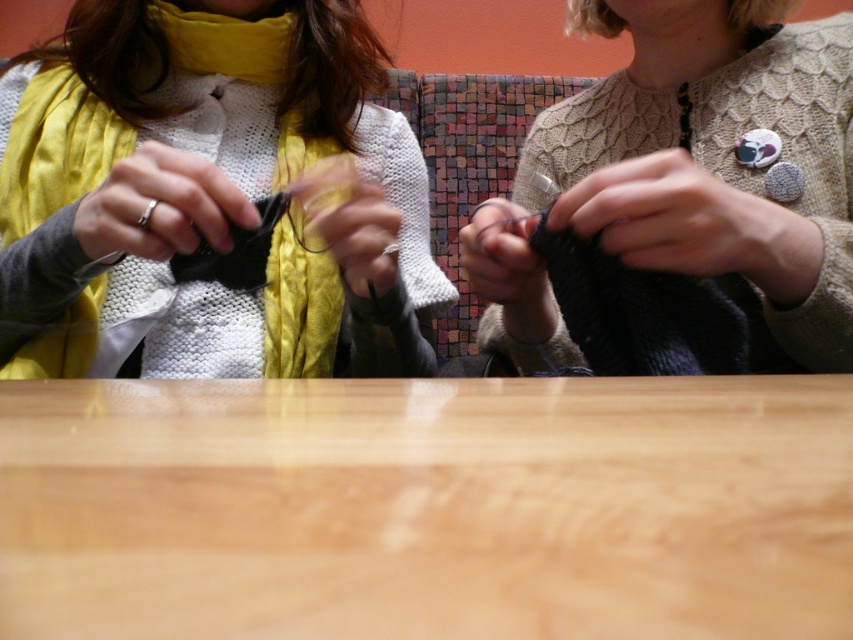
Who is more forward, (648, 220) or (334, 184)?

Positioned in front is point (648, 220).

Is point (697, 129) closer to viewer compared to point (376, 269)?

No, it is not.

Where is `knitted beige sweater at center`? The width and height of the screenshot is (853, 640). knitted beige sweater at center is located at coordinates (688, 173).

Which is behind, point (517, 547) or point (312, 164)?

Point (312, 164)

Is wooden table at center to the right of matte black glasses at center from the viewer's perspective?

Yes, wooden table at center is to the right of matte black glasses at center.

Between point (45, 432) and point (317, 228), which one is positioned behind?

Point (317, 228)

Where is `wooden table at center`? wooden table at center is located at coordinates (426, 508).

Which of these two, matte black fabric at center or black yarn at center, stands shorter?

With less height is black yarn at center.

Does point (346, 266) come farther from viewer compared to point (462, 260)?

No, it is not.

Identify the location of matte black fabric at center. This screenshot has width=853, height=640. coord(206,193).